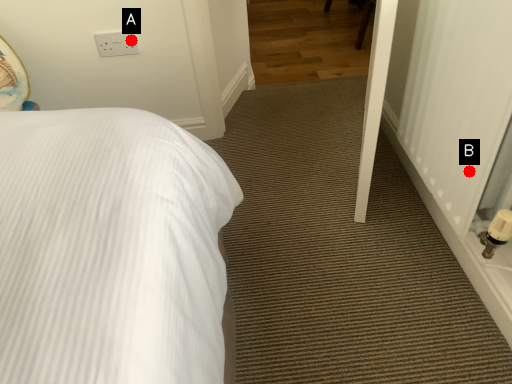
Question: Two points are circled on the image, labeled by A and B beside each circle. Which point appears closest to the camera in this image?

Choices:
 (A) A is closer
 (B) B is closer

Answer: (B)